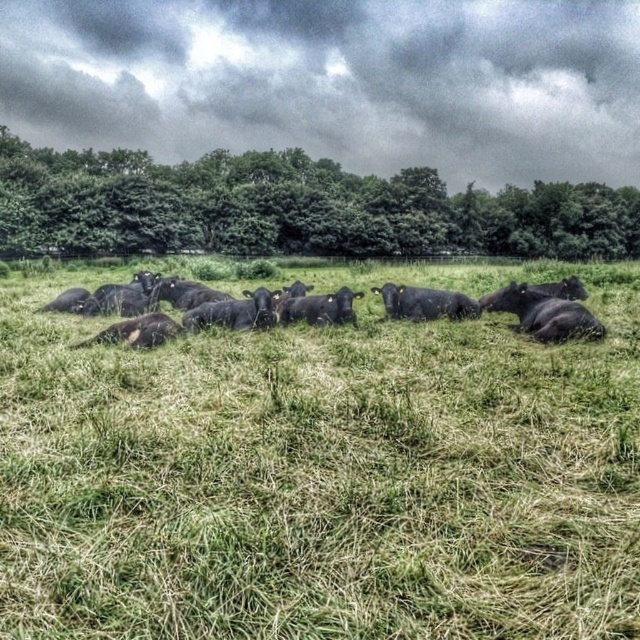
Question: Which object appears closest to the camera in this image?

Choices:
 (A) dark gray cloud at upper center
 (B) green leafy tree at upper center
 (C) black matte cow at center
 (D) black matte cows at center

Answer: (D)

Question: Among these objects, which one is nearest to the camera?

Choices:
 (A) black grass at center
 (B) dark gray cloud at upper center

Answer: (A)

Question: Is dark gray cloud at upper center further to camera compared to black matte cow at center?

Choices:
 (A) yes
 (B) no

Answer: (A)

Question: Which point is farther to the camera?

Choices:
 (A) (285, 369)
 (B) (387, 284)

Answer: (B)

Question: Can you confirm if dark gray cloud at upper center is positioned above black matte cow at center?

Choices:
 (A) yes
 (B) no

Answer: (A)

Question: Can you confirm if black matte cows at center is bigger than black matte cow at center?

Choices:
 (A) yes
 (B) no

Answer: (A)